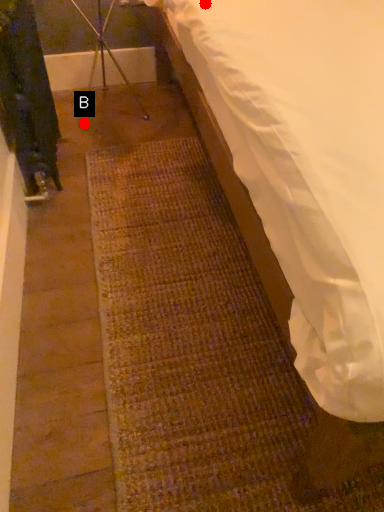
Question: Two points are circled on the image, labeled by A and B beside each circle. Among these points, which one is nearest to the camera?

Choices:
 (A) A is closer
 (B) B is closer

Answer: (A)